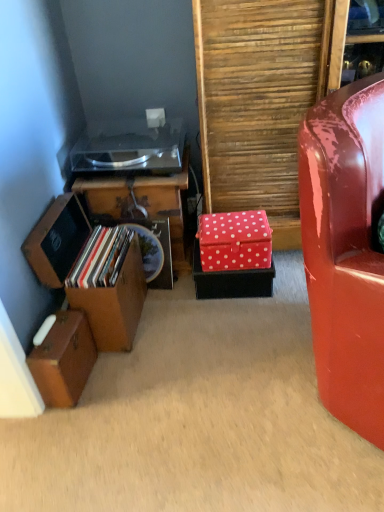
Question: Can you confirm if wooden suitcase at lower left, marked as the first storage box in a left-to-right arrangement, is shorter than wooden storage box at left, the second storage box in the left-to-right sequence?

Choices:
 (A) yes
 (B) no

Answer: (A)

Question: Is wooden suitcase at lower left, placed as the third storage box when sorted from right to left, bigger than wooden storage box at left, positioned as the second storage box in right-to-left order?

Choices:
 (A) no
 (B) yes

Answer: (A)

Question: Does wooden suitcase at lower left, placed as the third storage box when sorted from right to left, turn towards wooden storage box at left, the second storage box in the left-to-right sequence?

Choices:
 (A) yes
 (B) no

Answer: (B)

Question: Is wooden storage box at left, positioned as the second storage box in right-to-left order, located within wooden suitcase at lower left, marked as the first storage box in a left-to-right arrangement?

Choices:
 (A) yes
 (B) no

Answer: (B)

Question: Considering the relative sizes of wooden suitcase at lower left, placed as the third storage box when sorted from right to left, and wooden storage box at left, positioned as the second storage box in right-to-left order, in the image provided, is wooden suitcase at lower left, placed as the third storage box when sorted from right to left, smaller than wooden storage box at left, positioned as the second storage box in right-to-left order,?

Choices:
 (A) no
 (B) yes

Answer: (B)

Question: Does point (99, 182) appear closer or farther from the camera than point (119, 301)?

Choices:
 (A) closer
 (B) farther

Answer: (B)

Question: Is wooden cabinet at left wider or thinner than wooden storage box at left, the second storage box in the left-to-right sequence?

Choices:
 (A) thin
 (B) wide

Answer: (B)

Question: From the image's perspective, relative to wooden storage box at left, positioned as the second storage box in right-to-left order, is wooden cabinet at left above or below?

Choices:
 (A) above
 (B) below

Answer: (A)

Question: In the image, is wooden cabinet at left positioned in front of or behind wooden storage box at left, positioned as the second storage box in right-to-left order?

Choices:
 (A) front
 (B) behind

Answer: (B)

Question: From a real-world perspective, is wooden cabinet at left above or below red polka dot fabric box at center, which ranks as the 1th storage box in right-to-left order?

Choices:
 (A) above
 (B) below

Answer: (A)

Question: Considering the positions of point (87, 201) and point (261, 266), is point (87, 201) closer or farther from the camera than point (261, 266)?

Choices:
 (A) closer
 (B) farther

Answer: (B)

Question: Visually, is wooden cabinet at left positioned to the left or to the right of red polka dot fabric box at center, positioned as the 3th storage box in left-to-right order?

Choices:
 (A) left
 (B) right

Answer: (A)

Question: Do you think wooden cabinet at left is within red polka dot fabric box at center, which ranks as the 1th storage box in right-to-left order, or outside of it?

Choices:
 (A) outside
 (B) inside

Answer: (A)

Question: From a real-world perspective, is red polka dot fabric box at center, positioned as the 3th storage box in left-to-right order, above or below glossy red chair at right?

Choices:
 (A) above
 (B) below

Answer: (B)

Question: In the image, is red polka dot fabric box at center, which ranks as the 1th storage box in right-to-left order, positioned in front of or behind glossy red chair at right?

Choices:
 (A) behind
 (B) front

Answer: (A)